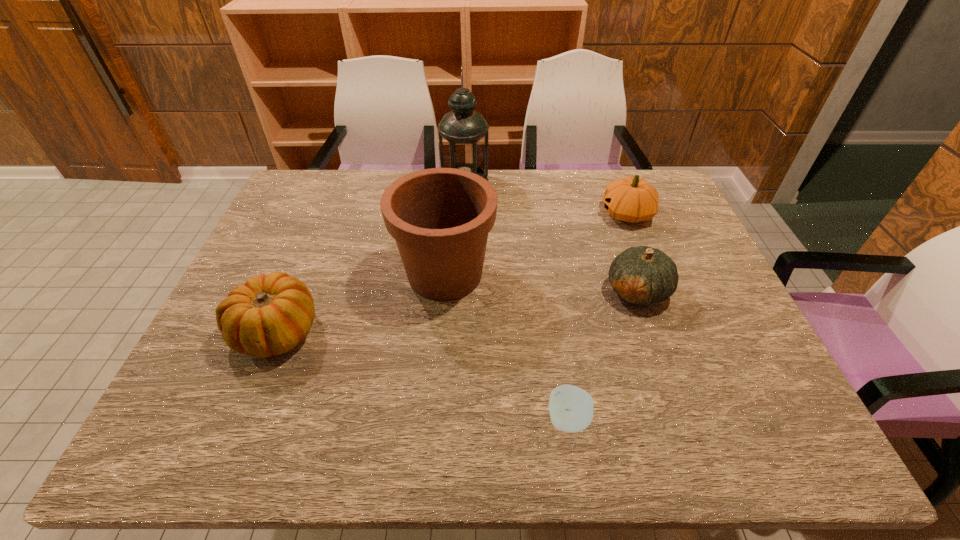
Where is `vacant region at the near edge of the desktop`? The height and width of the screenshot is (540, 960). vacant region at the near edge of the desktop is located at coordinates (470, 421).

I want to click on blank space at the left edge, so click(x=251, y=267).

The height and width of the screenshot is (540, 960). In order to click on free location at the right edge of the desktop in this screenshot , I will do `click(682, 253)`.

In the image, there is a desktop. Where is `vacant space at the far right corner`? vacant space at the far right corner is located at coordinates (664, 184).

Image resolution: width=960 pixels, height=540 pixels. Identify the location of free point between the farthest object and the leftmost gourd. (371, 256).

Find the location of a particular element. vacant point located between the flowerpot and the fifth nearest object is located at coordinates (536, 244).

Locate an element on the screen. Image resolution: width=960 pixels, height=540 pixels. vacant area that lies between the apple and the leftmost object is located at coordinates (422, 375).

Image resolution: width=960 pixels, height=540 pixels. Identify the location of vacant point located between the farthest object and the third object from right to left. (516, 301).

At what (x,y) coordinates should I click in order to perform the action: click on object that is the fifth closest to the farthest gourd. Please return your answer as a coordinate pair (x, y). This screenshot has width=960, height=540. Looking at the image, I should click on (271, 314).

Where is `object that is the fourth closest one to the farthest object`? This screenshot has width=960, height=540. object that is the fourth closest one to the farthest object is located at coordinates (271, 314).